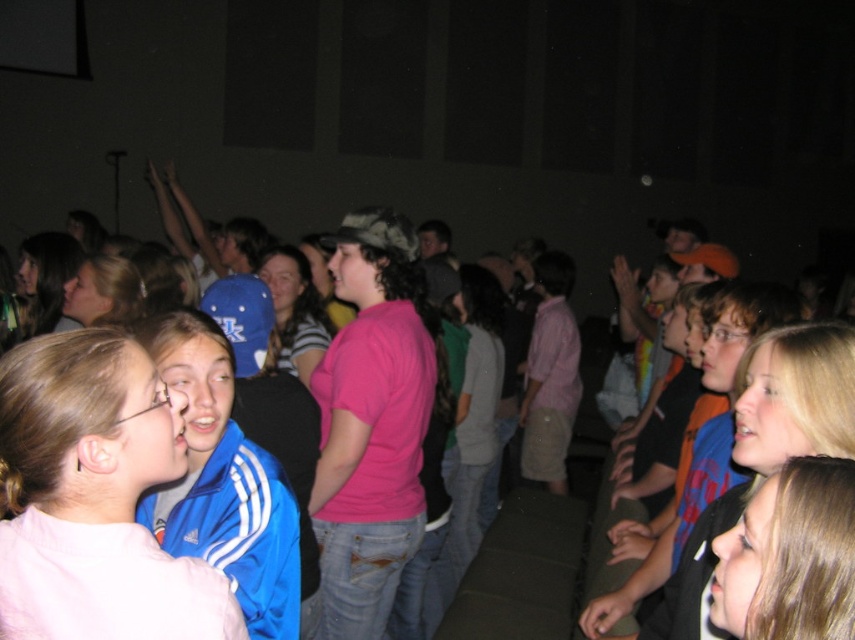
Which is more to the left, pink matte shirt at center or blue synthetic jacket at center?

pink matte shirt at center

Which is more to the right, pink matte shirt at center or blue synthetic jacket at center?

From the viewer's perspective, blue synthetic jacket at center appears more on the right side.

Find the location of a particular element. pink matte shirt at center is located at coordinates (93, 497).